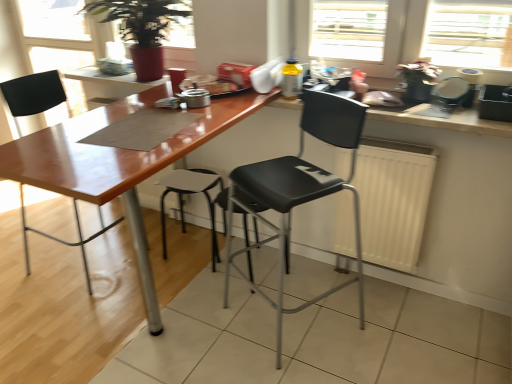
Measure the distance between matte wood table at center, the 2th table viewed from the top, and camera.

matte wood table at center, the 2th table viewed from the top, is 1.15 meters from camera.

I want to click on black plastic chair at center, placed as the 1th chair when sorted from right to left, so click(298, 191).

Where is `white matte radiator at center`? white matte radiator at center is located at coordinates (393, 200).

From a real-world perspective, between matte black chair at left, which is the second chair from right to left, and wooden countertop at upper right, who is vertically higher?

wooden countertop at upper right is physically above.

Is matte black chair at left, which is the 1th chair from left to right, inside or outside of wooden countertop at upper right?

matte black chair at left, which is the 1th chair from left to right, is not inside wooden countertop at upper right, it's outside.

Is matte black chair at left, which is the second chair from right to left, behind wooden countertop at upper right?

That is True.

Measure the distance between matte black chair at left, which is the second chair from right to left, and wooden countertop at upper right.

matte black chair at left, which is the second chair from right to left, is 1.64 meters from wooden countertop at upper right.

Considering the sizes of matte wood table at center, the 2th table viewed from the top, and white matte radiator at center in the image, is matte wood table at center, the 2th table viewed from the top, wider or thinner than white matte radiator at center?

Considering their sizes, matte wood table at center, the 2th table viewed from the top, looks broader than white matte radiator at center.

From a real-world perspective, which object rests below the other?

In real-world perspective, white matte radiator at center is lower.

Where is `radiator that is behind the matte wood table at center, the first table ordered from the bottom`? This screenshot has width=512, height=384. radiator that is behind the matte wood table at center, the first table ordered from the bottom is located at coordinates (393, 200).

Is matte wood table at center, the first table ordered from the bottom, shorter than white matte radiator at center?

Incorrect, the height of matte wood table at center, the first table ordered from the bottom, does not fall short of that of white matte radiator at center.

Which is behind, point (400, 224) or point (262, 94)?

The point (262, 94) is behind.

From a real-world perspective, is white matte radiator at center above or below matte wood table at center, the first table ordered from the bottom?

white matte radiator at center is situated lower than matte wood table at center, the first table ordered from the bottom, in the real world.

Would you consider white matte radiator at center to be distant from matte wood table at center, the 2th table viewed from the top?

No, white matte radiator at center is not far away from matte wood table at center, the 2th table viewed from the top.

Is white matte radiator at center located outside matte wood table at center, the first table ordered from the bottom?

That's correct, white matte radiator at center is outside of matte wood table at center, the first table ordered from the bottom.

Is matte wood table at center, the 2th table positioned from the bottom, positioned behind matte wood table at center, the first table ordered from the bottom?

Yes, it is behind matte wood table at center, the first table ordered from the bottom.

Is the surface of matte wood table at center, the 2th table positioned from the bottom, in direct contact with matte wood table at center, the first table ordered from the bottom?

No, matte wood table at center, the 2th table positioned from the bottom, is not beside matte wood table at center, the first table ordered from the bottom.

Which of these two, matte wood table at center, the 2th table positioned from the bottom, or matte wood table at center, the 2th table viewed from the top, is smaller?

matte wood table at center, the 2th table positioned from the bottom, is smaller.

Which is in front, point (156, 85) or point (55, 133)?

Point (55, 133)

Find the location of a particular element. The width and height of the screenshot is (512, 384). table below the matte black chair at left, which is the 1th chair from left to right (from the image's perspective) is located at coordinates (117, 163).

Is matte black chair at left, which is the 1th chair from left to right, outside of matte wood table at center, the first table ordered from the bottom?

Indeed, matte black chair at left, which is the 1th chair from left to right, is completely outside matte wood table at center, the first table ordered from the bottom.

Can you confirm if matte black chair at left, which is the second chair from right to left, is smaller than matte wood table at center, the 2th table viewed from the top?

Yes.

Does matte black chair at left, which is the 1th chair from left to right, turn towards matte wood table at center, the 2th table viewed from the top?

Yes.

Does wooden countertop at upper right have a greater height compared to matte wood table at center, the 2th table viewed from the top?

In fact, wooden countertop at upper right may be shorter than matte wood table at center, the 2th table viewed from the top.

Looking at this image, considering the relative sizes of wooden countertop at upper right and matte wood table at center, the 2th table viewed from the top, in the image provided, is wooden countertop at upper right smaller than matte wood table at center, the 2th table viewed from the top,?

Correct, wooden countertop at upper right occupies less space than matte wood table at center, the 2th table viewed from the top.

Is wooden countertop at upper right positioned in front of matte wood table at center, the 2th table viewed from the top?

No, wooden countertop at upper right is further to the viewer.

From the image's perspective, between matte wood table at center, which is the first table in top-to-bottom order, and wooden countertop at upper right, which one is located above?

matte wood table at center, which is the first table in top-to-bottom order.

Which of these two, matte wood table at center, the 2th table positioned from the bottom, or wooden countertop at upper right, is bigger?

matte wood table at center, the 2th table positioned from the bottom.

Which of these two, matte wood table at center, the 2th table positioned from the bottom, or wooden countertop at upper right, stands shorter?

wooden countertop at upper right.

Where is `chair behind the wooden countertop at upper right`? chair behind the wooden countertop at upper right is located at coordinates (33, 94).

This screenshot has width=512, height=384. What are the coordinates of `table that appears below the white matte radiator at center (from the image's perspective)` in the screenshot? It's located at (117, 163).

Based on their spatial positions, is matte wood table at center, which is the first table in top-to-bottom order, or matte black chair at left, which is the second chair from right to left, further from white matte radiator at center?

matte black chair at left, which is the second chair from right to left.

When comparing their distances from matte wood table at center, the first table ordered from the bottom, does black plastic chair at center, which is the second chair from left to right, or matte black chair at left, which is the 1th chair from left to right, seem closer?

Based on the image, black plastic chair at center, which is the second chair from left to right, appears to be nearer to matte wood table at center, the first table ordered from the bottom.

Which object lies nearer to the anchor point white matte radiator at center, matte black chair at left, which is the 1th chair from left to right, or matte wood table at center, the 2th table positioned from the bottom?

matte wood table at center, the 2th table positioned from the bottom, lies closer to white matte radiator at center than the other object.

In the scene shown: When comparing their distances from matte wood table at center, the 2th table viewed from the top, does matte wood table at center, which is the first table in top-to-bottom order, or matte black chair at left, which is the second chair from right to left, seem closer?

matte wood table at center, which is the first table in top-to-bottom order, is positioned closer to the anchor matte wood table at center, the 2th table viewed from the top.

Looking at the image, which one is located further to matte wood table at center, the 2th table viewed from the top, matte black chair at left, which is the second chair from right to left, or matte black stool at center?

The object further to matte wood table at center, the 2th table viewed from the top, is matte black chair at left, which is the second chair from right to left.

Looking at the image, which one is located further to white matte radiator at center, matte wood table at center, the 2th table positioned from the bottom, or matte wood table at center, the first table ordered from the bottom?

matte wood table at center, the 2th table positioned from the bottom, is positioned further to the anchor white matte radiator at center.

From the image, which object appears to be nearer to matte black chair at left, which is the second chair from right to left, matte wood table at center, the 2th table positioned from the bottom, or matte black stool at center?

The object closer to matte black chair at left, which is the second chair from right to left, is matte black stool at center.

Estimate the real-world distances between objects in this image. Which object is further from wooden countertop at upper right, matte black chair at left, which is the second chair from right to left, or matte wood table at center, the 2th table positioned from the bottom?

matte black chair at left, which is the second chair from right to left.

Where is `chair between matte black chair at left, which is the 1th chair from left to right, and white matte radiator at center`? This screenshot has width=512, height=384. chair between matte black chair at left, which is the 1th chair from left to right, and white matte radiator at center is located at coordinates (298, 191).

The width and height of the screenshot is (512, 384). What are the coordinates of `chair between matte wood table at center, which is the first table in top-to-bottom order, and wooden countertop at upper right` in the screenshot? It's located at (298, 191).

Locate an element on the screen. The width and height of the screenshot is (512, 384). step stool between matte black chair at left, which is the 1th chair from left to right, and wooden countertop at upper right from left to right is located at coordinates (190, 193).

The width and height of the screenshot is (512, 384). Identify the location of step stool between matte wood table at center, the first table ordered from the bottom, and matte wood table at center, which is the first table in top-to-bottom order, in the front-back direction. (190, 193).